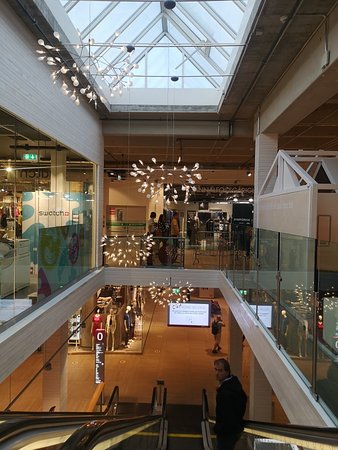
The width and height of the screenshot is (338, 450). I want to click on floor, so click(x=186, y=365).